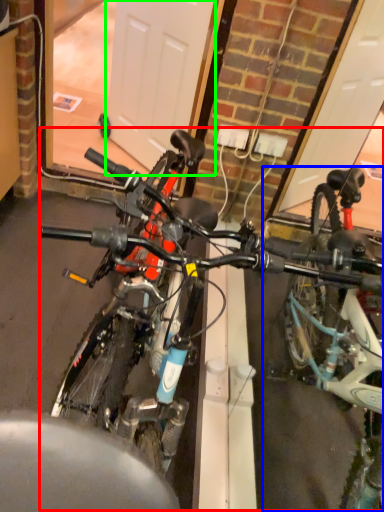
Question: Which object is the farthest from bicycle (highlighted by a red box)? Choose among these: bicycle (highlighted by a blue box) or garage door (highlighted by a green box).

Choices:
 (A) bicycle
 (B) garage door

Answer: (B)